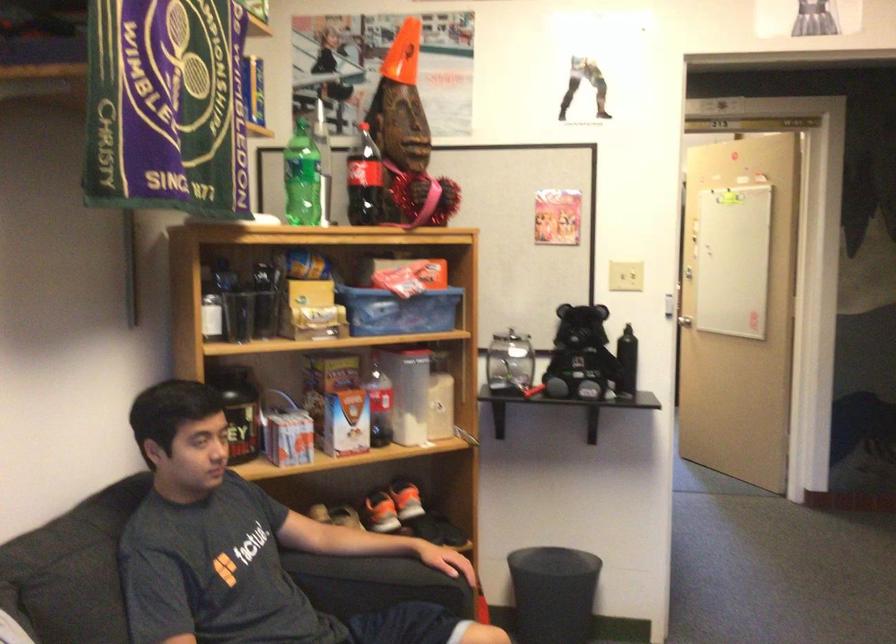
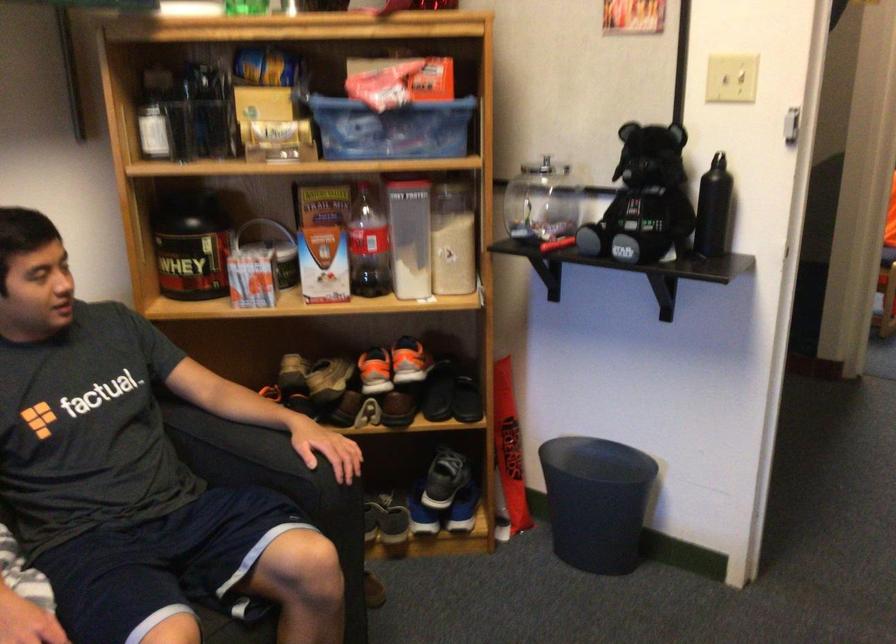
Locate, in the second image, the point that corresponds to the point at 636,274 in the first image.

(730, 78)